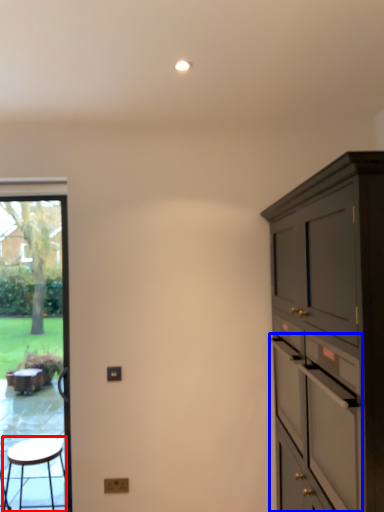
Question: Which object is closer to the camera taking this photo, stool (highlighted by a red box) or drawer (highlighted by a blue box)?

Choices:
 (A) stool
 (B) drawer

Answer: (B)